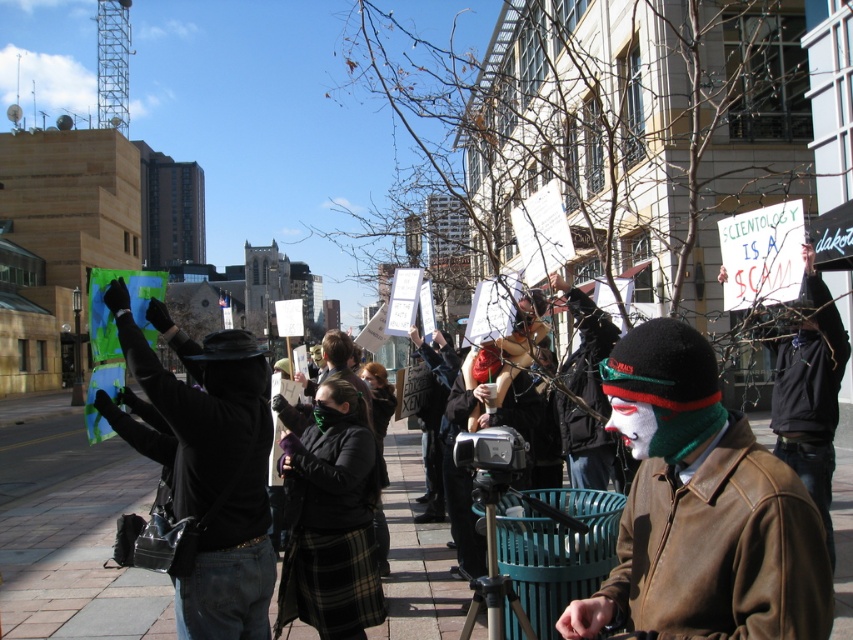
Question: Which point is farther to the camera?

Choices:
 (A) (253, 509)
 (B) (738, 436)

Answer: (A)

Question: Is brown leather jacket at center below black leather jacket at center?

Choices:
 (A) yes
 (B) no

Answer: (A)

Question: Can you confirm if brown leather jacket at center is positioned to the right of black leather jacket at center?

Choices:
 (A) yes
 (B) no

Answer: (A)

Question: In this image, where is brown leather jacket at center located relative to black leather jacket at center?

Choices:
 (A) right
 (B) left

Answer: (A)

Question: Which point is closer to the camera?

Choices:
 (A) brown leather jacket at center
 (B) black leather jacket at center

Answer: (A)